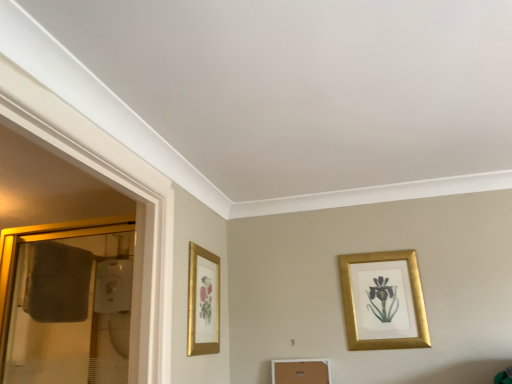
Question: Looking at their shapes, would you say gold metallic picture frame at upper right, placed as the 1th picture frame when sorted from right to left, is wider or thinner than gold framed picture at left, the second picture frame when ordered from right to left?

Choices:
 (A) thin
 (B) wide

Answer: (B)

Question: From a real-world perspective, is gold metallic picture frame at upper right, which appears as the 2th picture frame when viewed from the left, above or below gold framed picture at left, the first picture frame viewed from the left?

Choices:
 (A) below
 (B) above

Answer: (A)

Question: Which object is positioned closest to the gold-framed mirror at left?

Choices:
 (A) gold metallic picture frame at upper right, which appears as the 2th picture frame when viewed from the left
 (B) gold framed picture at left, the first picture frame viewed from the left

Answer: (B)

Question: Which object is the closest to the gold framed picture at left, the second picture frame when ordered from right to left?

Choices:
 (A) gold-framed mirror at left
 (B) gold metallic picture frame at upper right, placed as the 1th picture frame when sorted from right to left

Answer: (B)